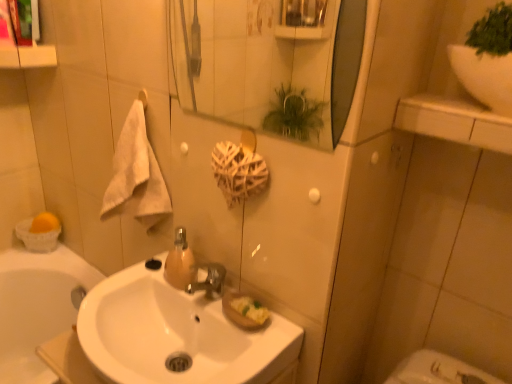
I want to click on white glossy sink at center, so click(x=176, y=334).

Measure the distance between glossy glass mirror at upper center and camera.

1.70 meters.

I want to click on white glossy sink at center, so click(176, 334).

In terms of width, does glossy glass mirror at upper center look wider or thinner when compared to white glossy sink at upper right?

Clearly, glossy glass mirror at upper center has less width compared to white glossy sink at upper right.

From the picture: Is glossy glass mirror at upper center to the left or to the right of white glossy sink at upper right in the image?

Based on their positions, glossy glass mirror at upper center is located to the left of white glossy sink at upper right.

Is glossy glass mirror at upper center completely or partially outside of white glossy sink at upper right?

Yes.

Which point is more forward, (262,98) or (433,95)?

The point (433,95) is in front.

From the image's perspective, between glossy glass mirror at upper center and white glossy sink at center, which one is located above?

glossy glass mirror at upper center is shown above in the image.

Is glossy glass mirror at upper center not close to white glossy sink at center?

Absolutely, glossy glass mirror at upper center is distant from white glossy sink at center.

Would you say white glossy sink at center is part of glossy glass mirror at upper center's contents?

No, white glossy sink at center is not surrounded by glossy glass mirror at upper center.

Which object is positioned more to the right, white glossy sink at upper right or glossy glass mirror at upper center?

From the viewer's perspective, white glossy sink at upper right appears more on the right side.

Locate an element on the screen. counter top directly beneath the glossy glass mirror at upper center (from a real-world perspective) is located at coordinates (454, 121).

Does white glossy sink at upper right have a greater height compared to glossy glass mirror at upper center?

No, white glossy sink at upper right is not taller than glossy glass mirror at upper center.

Is white glossy sink at upper right oriented away from glossy glass mirror at upper center?

white glossy sink at upper right is not turned away from glossy glass mirror at upper center.

Is white glossy sink at center further to the viewer compared to glossy glass mirror at upper center?

Yes, it is.

Based on the photo, is white glossy sink at center oriented towards glossy glass mirror at upper center?

No, white glossy sink at center is not turned towards glossy glass mirror at upper center.

Considering the relative sizes of white glossy sink at center and glossy glass mirror at upper center in the image provided, is white glossy sink at center smaller than glossy glass mirror at upper center?

Actually, white glossy sink at center might be larger than glossy glass mirror at upper center.

Considering the sizes of objects white glossy sink at center and glossy glass mirror at upper center in the image provided, who is wider, white glossy sink at center or glossy glass mirror at upper center?

white glossy sink at center is wider.

Locate an element on the screen. counter top above the white glossy sink at center (from a real-world perspective) is located at coordinates (454, 121).

Who is smaller, white glossy sink at center or white glossy sink at upper right?

white glossy sink at upper right is smaller.

Does white glossy sink at center have a lesser height compared to white glossy sink at upper right?

In fact, white glossy sink at center may be taller than white glossy sink at upper right.

Which of these two, glossy glass mirror at upper center or white fluffy towel at left, is smaller?

glossy glass mirror at upper center is smaller.

From the image's perspective, is glossy glass mirror at upper center on top of white fluffy towel at left?

Yes, from the image's perspective, glossy glass mirror at upper center is above white fluffy towel at left.

Relative to white fluffy towel at left, is glossy glass mirror at upper center in front or behind?

Visually, glossy glass mirror at upper center is located in front of white fluffy towel at left.

From the image's perspective, is glossy glass mirror at upper center located above or below translucent amber glass soap dispenser at center?

glossy glass mirror at upper center is above translucent amber glass soap dispenser at center.

Who is taller, glossy glass mirror at upper center or translucent amber glass soap dispenser at center?

glossy glass mirror at upper center.

Is glossy glass mirror at upper center smaller than translucent amber glass soap dispenser at center?

Incorrect, glossy glass mirror at upper center is not smaller in size than translucent amber glass soap dispenser at center.

Is point (322, 118) closer or farther from the camera than point (178, 284)?

Point (322, 118).

Image resolution: width=512 pixels, height=384 pixels. In order to click on mirror on the left of white glossy sink at upper right in this screenshot , I will do tap(269, 63).

At what (x,y) coordinates should I click in order to perform the action: click on mirror that is above the white glossy sink at center (from the image's perspective). Please return your answer as a coordinate pair (x, y). The image size is (512, 384). Looking at the image, I should click on (269, 63).

Considering their positions, is translucent amber glass soap dispenser at center positioned closer to white fluffy towel at left than white glossy sink at center?

translucent amber glass soap dispenser at center lies closer to white fluffy towel at left than the other object.

Estimate the real-world distances between objects in this image. Which object is further from white glossy sink at center, white fluffy towel at left or glossy glass mirror at upper center?

glossy glass mirror at upper center lies further to white glossy sink at center than the other object.

Considering their positions, is white glossy sink at upper right positioned closer to translucent amber glass soap dispenser at center than white fluffy towel at left?

The object closer to translucent amber glass soap dispenser at center is white fluffy towel at left.

Estimate the real-world distances between objects in this image. Which object is closer to translucent amber glass soap dispenser at center, white glossy sink at center or white fluffy towel at left?

white glossy sink at center.

Based on their spatial positions, is white glossy sink at upper right or glossy glass mirror at upper center further from white glossy sink at center?

Based on the image, glossy glass mirror at upper center appears to be further to white glossy sink at center.

Estimate the real-world distances between objects in this image. Which object is further from glossy glass mirror at upper center, white glossy sink at center or white glossy sink at upper right?

white glossy sink at upper right.

Looking at the image, which one is located closer to glossy glass mirror at upper center, white fluffy towel at left or translucent amber glass soap dispenser at center?

Among the two, white fluffy towel at left is located nearer to glossy glass mirror at upper center.

Considering their positions, is white glossy sink at upper right positioned closer to glossy glass mirror at upper center than white fluffy towel at left?

Based on the image, white fluffy towel at left appears to be nearer to glossy glass mirror at upper center.

Locate an element on the screen. This screenshot has width=512, height=384. soap dispenser situated between white glossy sink at center and white glossy sink at upper right from left to right is located at coordinates (180, 262).

In order to click on sink between white fluffy towel at left and white glossy sink at upper right from left to right in this screenshot , I will do `click(176, 334)`.

This screenshot has height=384, width=512. What are the coordinates of `soap dispenser between white fluffy towel at left and white glossy sink at center vertically` in the screenshot? It's located at (180, 262).

Find the location of a particular element. mirror between white fluffy towel at left and white glossy sink at upper right is located at coordinates (269, 63).